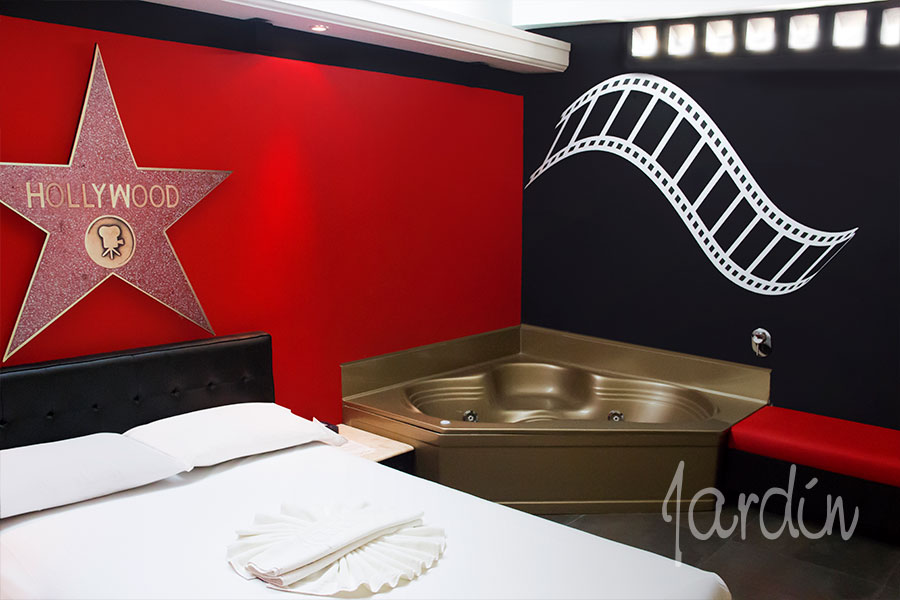
Image resolution: width=900 pixels, height=600 pixels. Identify the location of floor. (779, 586).